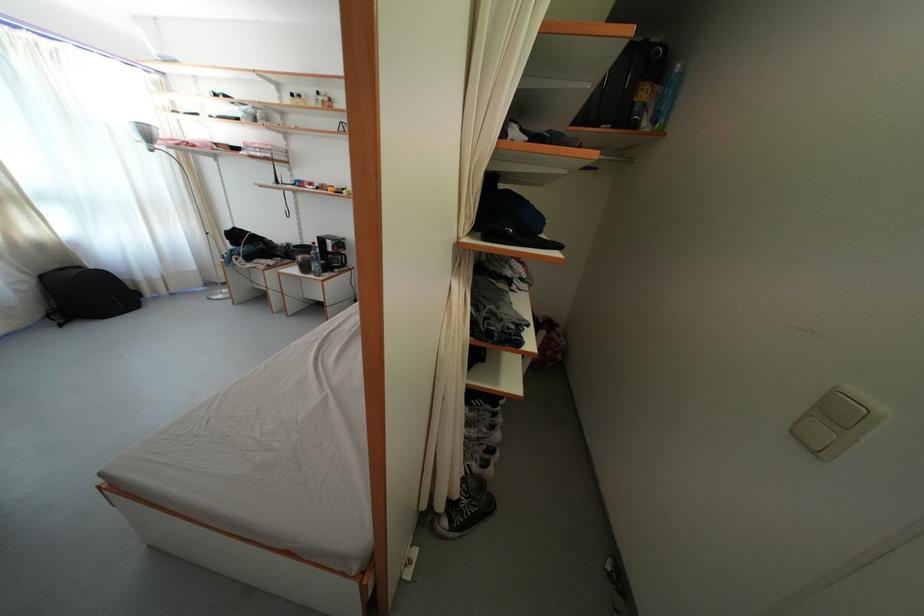
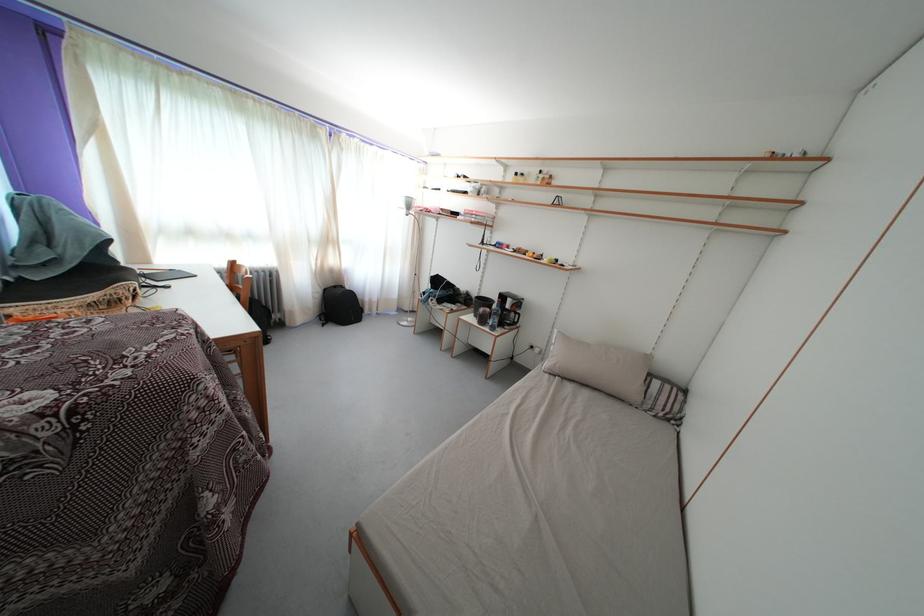
Question: Which direction would the cameraman need to move to produce the second image? Reply with the corresponding letter.

Choices:
 (A) Left
 (B) Right
 (C) Forward
 (D) Backward

Answer: (A)